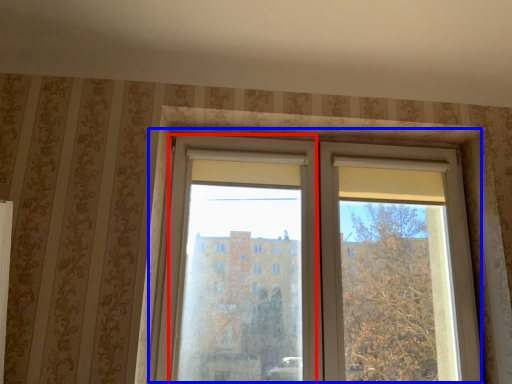
Question: Which object appears farthest to the camera in this image, screen door (highlighted by a red box) or window (highlighted by a blue box)?

Choices:
 (A) screen door
 (B) window

Answer: (B)